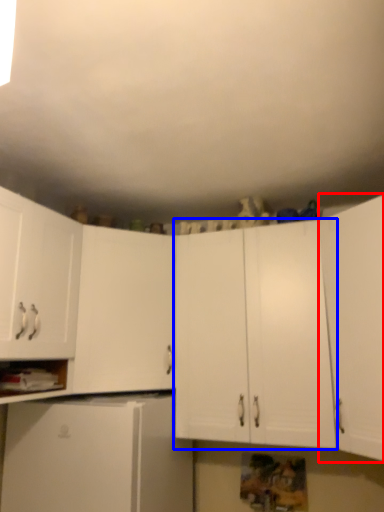
Question: Among these objects, which one is farthest to the camera, cabinetry (highlighted by a red box) or cabinetry (highlighted by a blue box)?

Choices:
 (A) cabinetry
 (B) cabinetry

Answer: (B)